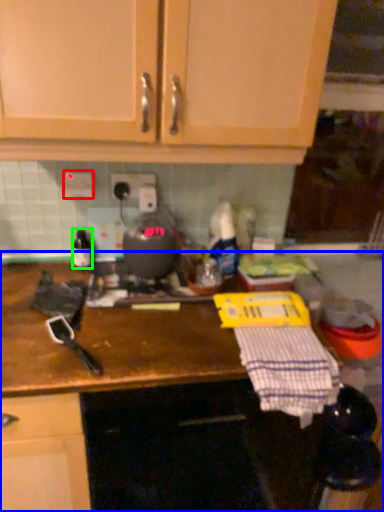
Question: Which object is positioned closest to electric outlet (highlighted by a red box)? Select from countertop (highlighted by a blue box) and bottle (highlighted by a green box).

Choices:
 (A) countertop
 (B) bottle

Answer: (B)